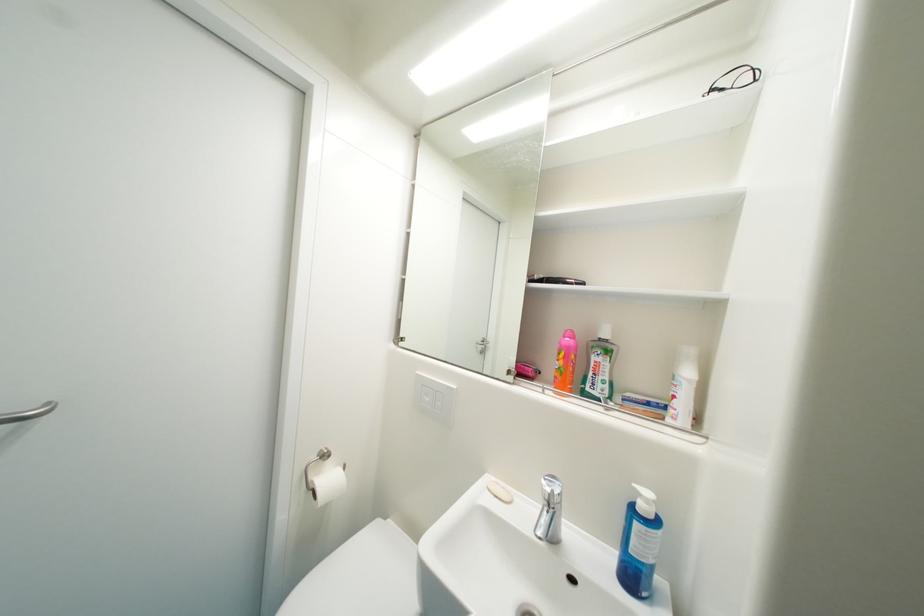
Find where to push the soap dispenser pump. Please return your answer as a coordinate pair (x, y).

(647, 515)